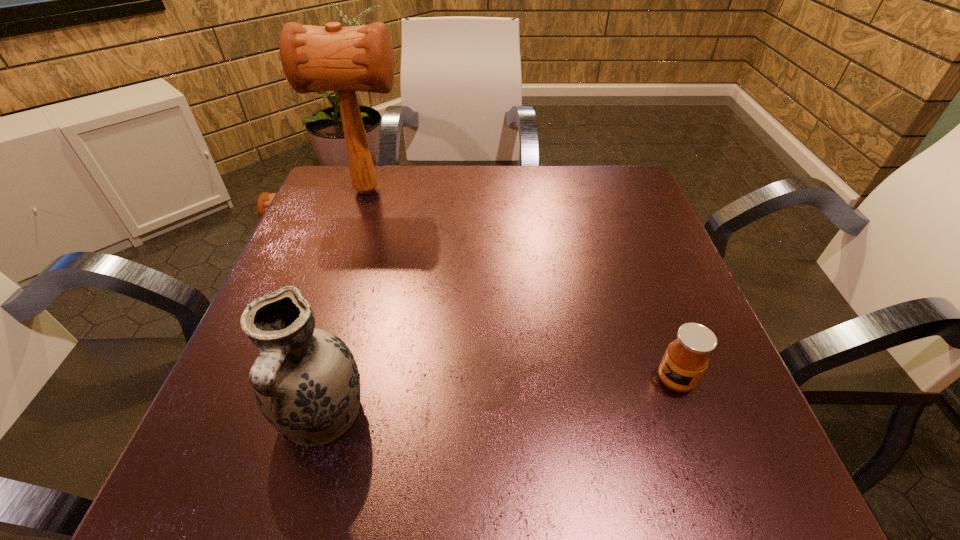
Locate an element on the screen. The width and height of the screenshot is (960, 540). empty space that is in between the second tallest object and the shortest object is located at coordinates (498, 398).

Where is `vacant space in between the tallest object and the shortest object`? The width and height of the screenshot is (960, 540). vacant space in between the tallest object and the shortest object is located at coordinates (521, 285).

Where is `vacant area that lies between the mallet and the second shortest object`? This screenshot has width=960, height=540. vacant area that lies between the mallet and the second shortest object is located at coordinates point(345,303).

Point out which object is positioned as the second nearest to the farthest object. Please provide its 2D coordinates. Your answer should be formatted as a tuple, i.e. [(x, y)], where the tuple contains the x and y coordinates of a point satisfying the conditions above.

[(687, 357)]

The width and height of the screenshot is (960, 540). What are the coordinates of `the closest object relative to the mallet` in the screenshot? It's located at (306, 382).

At what (x,y) coordinates should I click in order to perform the action: click on free space that satisfies the following two spatial constraints: 1. on the front-facing side of the rightmost object; 2. with the handle on the side of the second shortest object. Please return your answer as a coordinate pair (x, y). Looking at the image, I should click on (688, 416).

In order to click on vacant space that satisfies the following two spatial constraints: 1. on the front-facing side of the rightmost object; 2. with the handle on the side of the second tallest object in this screenshot , I will do `click(688, 416)`.

The width and height of the screenshot is (960, 540). Find the location of `free space in the image that satisfies the following two spatial constraints: 1. on the front-facing side of the shortest object; 2. with the handle on the side of the vase`. free space in the image that satisfies the following two spatial constraints: 1. on the front-facing side of the shortest object; 2. with the handle on the side of the vase is located at coordinates (688, 416).

The width and height of the screenshot is (960, 540). I want to click on free space in the image that satisfies the following two spatial constraints: 1. on the front-facing side of the honey; 2. with the handle on the side of the second shortest object, so point(688,416).